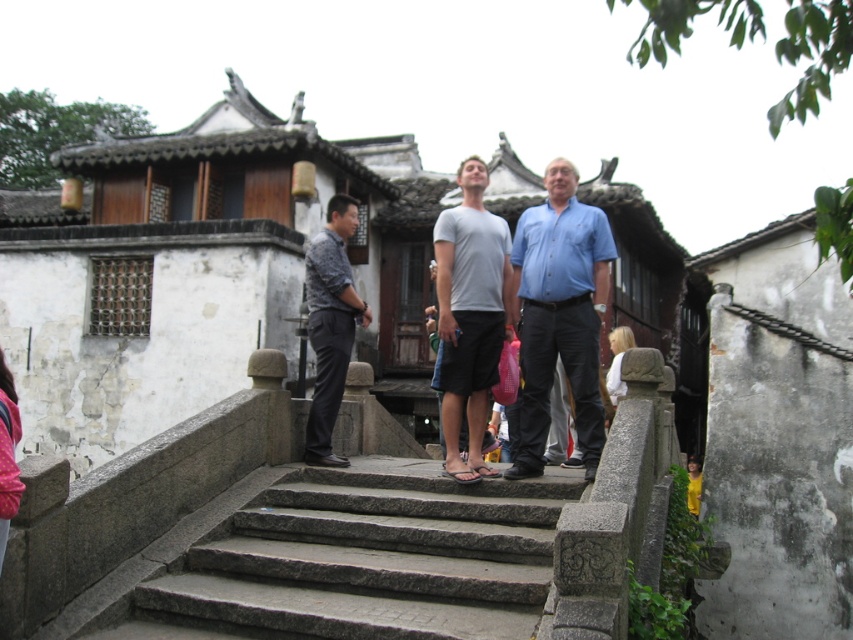
You are standing in front of a traditional East Asian building with a stone staircase. You see a blue cotton shirt at center. Where exactly is the blue cotton shirt located in relation to the staircase?

The blue cotton shirt at center is located at the coordinates point [560,314], which is near the center of the scene. Since the staircase is the focal point leading up to the building, the shirt is likely positioned somewhere along or near the staircase.

You are a photographer trying to capture a clear shot of the blue cotton shirt at center and the white cotton shirt at center. Which shirt should you focus on to ensure the other remains in the background?

You should focus on the blue cotton shirt at center because it is in front of the white cotton shirt at center, so focusing on it will keep the white cotton shirt at center in the background.